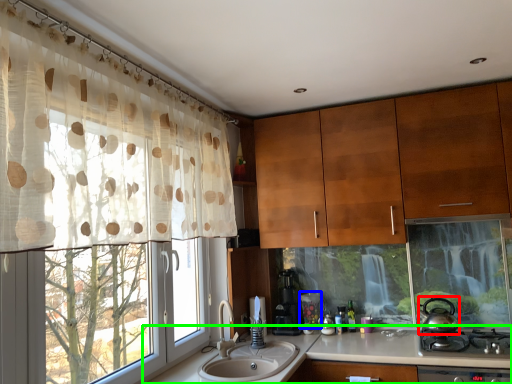
Question: Estimate the real-world distances between objects in this image. Which object is closer to tea pot (highlighted by a red box), appliance (highlighted by a blue box) or countertop (highlighted by a green box)?

Choices:
 (A) appliance
 (B) countertop

Answer: (B)